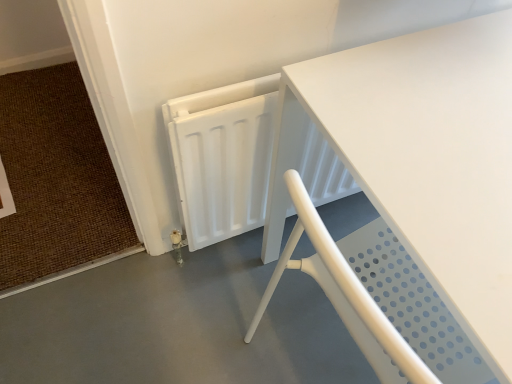
Locate an element on the screen. blank space situated above brown woven mat at lower left (from a real-world perspective) is located at coordinates (45, 172).